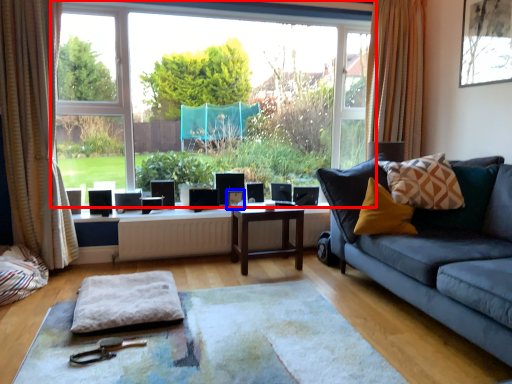
Question: Which object is further to the camera taking this photo, window (highlighted by a red box) or picture frame (highlighted by a blue box)?

Choices:
 (A) window
 (B) picture frame

Answer: (B)